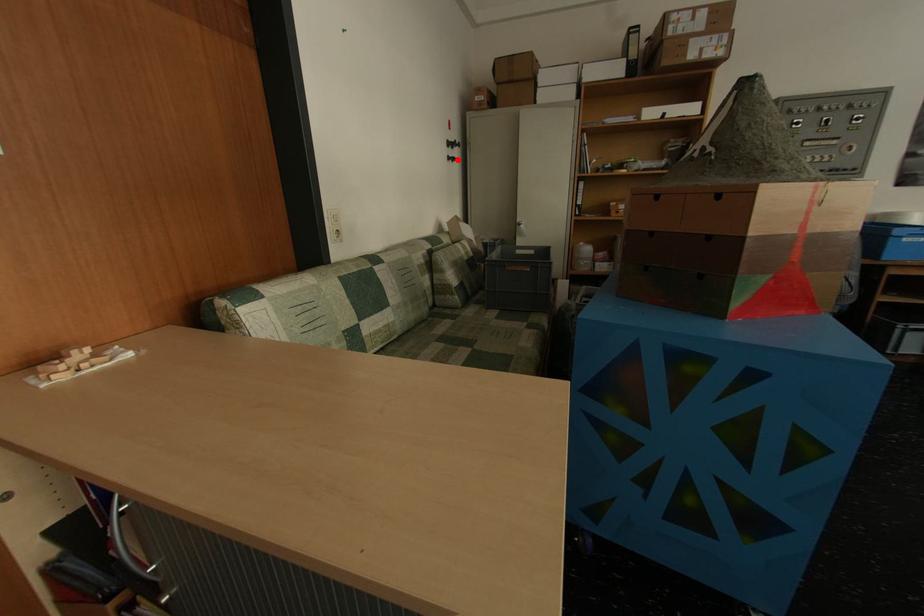
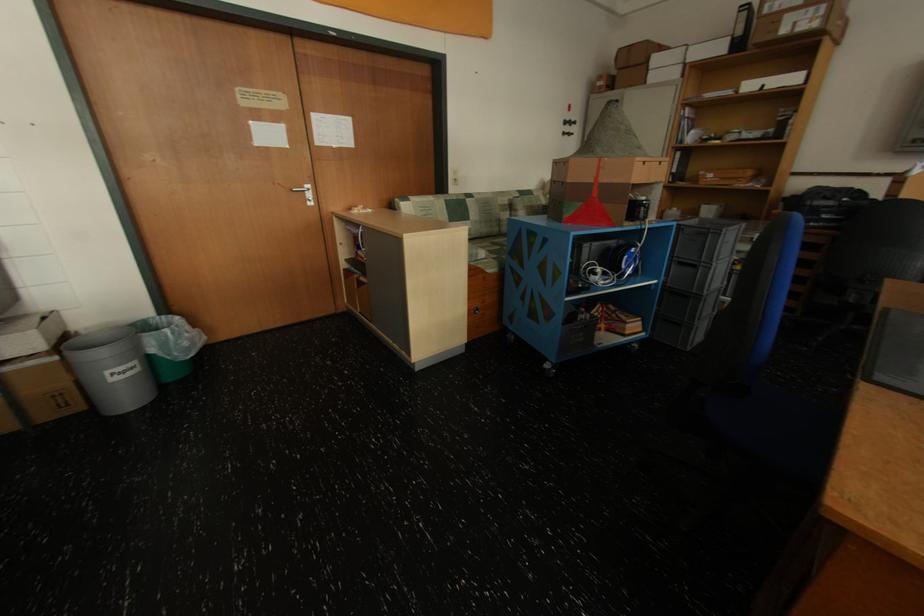
Question: I am providing you with two images of the same scene from different viewpoints. A red point is shown in image1. For the corresponding object point in image2, is it positioned nearer or farther from the camera?

Choices:
 (A) Nearer
 (B) Farther

Answer: (A)